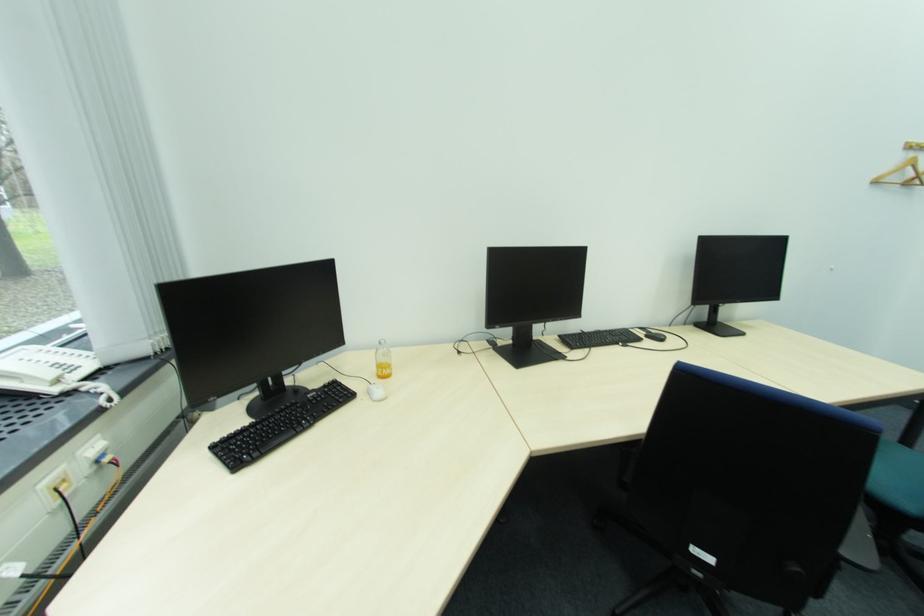
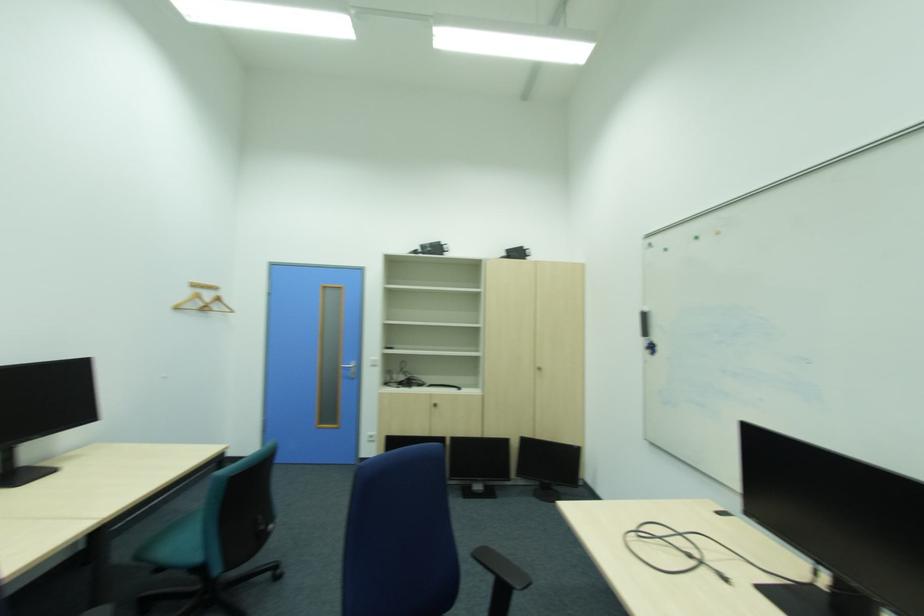
Locate, in the second image, the point that corresponds to the point at 722,312 in the first image.

(13, 459)